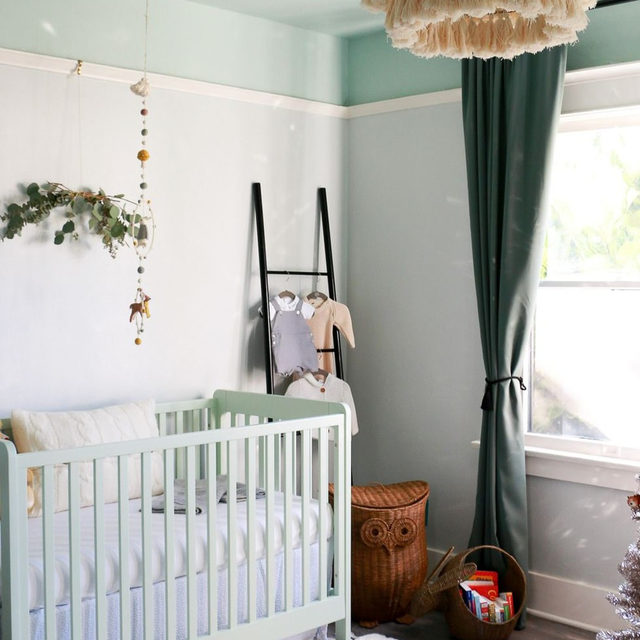
Identify the location of left curtain. The width and height of the screenshot is (640, 640). (525, 196).